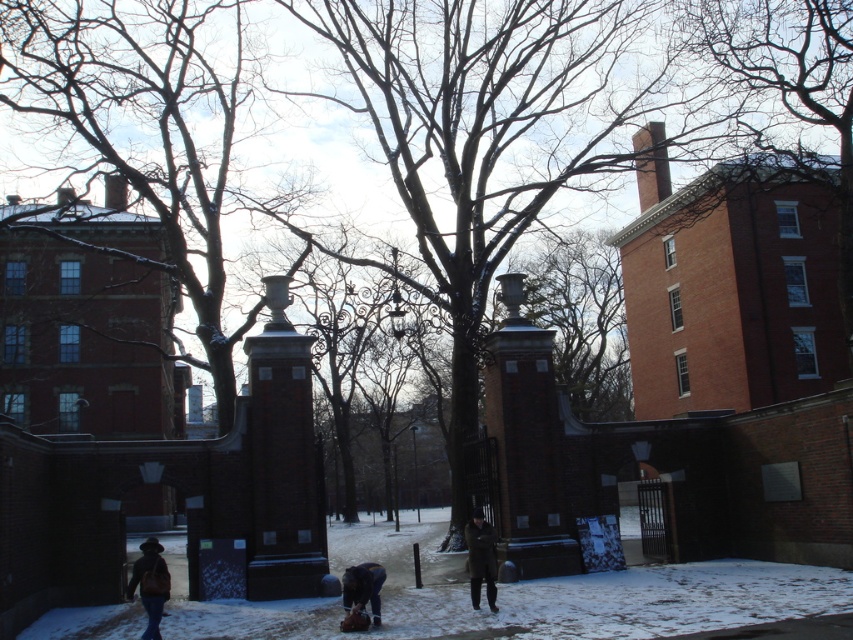
You are a photographer trying to capture both the dark brown leather coat at center and the dark brown leather jacket at lower center in the same frame. Based on their positions, which one should you adjust your camera angle to focus on first to ensure both are visible?

The dark brown leather coat at center is to the right of the dark brown leather jacket at lower center. To capture both in the same frame, you should adjust your camera angle to focus on the dark brown leather jacket at lower center first, as it is positioned lower and to the left, allowing the coat to be included to its right.